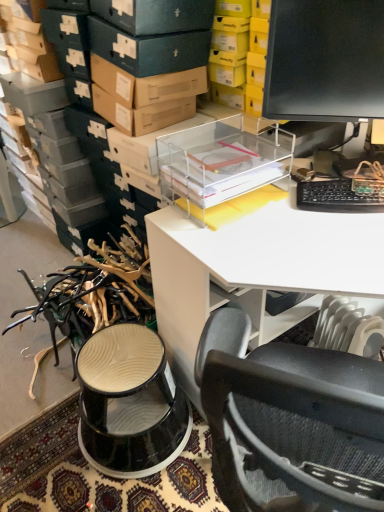
Question: Considering their positions, is transparent plastic desk at upper center located in front of or behind black plastic keyboard at right?

Choices:
 (A) behind
 (B) front

Answer: (B)

Question: From a real-world perspective, relative to black plastic keyboard at right, is transparent plastic desk at upper center vertically above or below?

Choices:
 (A) above
 (B) below

Answer: (B)

Question: Which is nearer to the black plastic keyboard at right?

Choices:
 (A) transparent plastic desk at upper center
 (B) black glossy monitor at upper right

Answer: (A)

Question: Which object is positioned farthest from the black glossy monitor at upper right?

Choices:
 (A) black plastic keyboard at right
 (B) transparent plastic desk at upper center

Answer: (B)